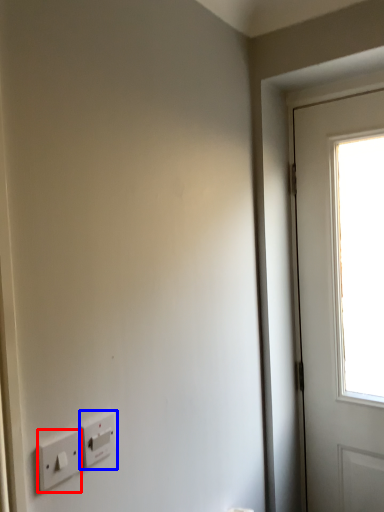
Question: Which object appears closest to the camera in this image, light switch (highlighted by a red box) or light switch (highlighted by a blue box)?

Choices:
 (A) light switch
 (B) light switch

Answer: (A)